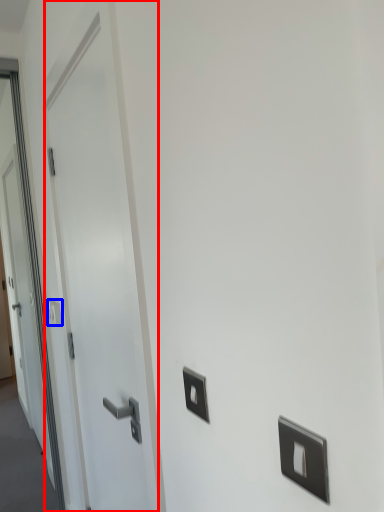
Question: Which of the following is the farthest to the observer, door (highlighted by a red box) or light switch (highlighted by a blue box)?

Choices:
 (A) door
 (B) light switch

Answer: (B)